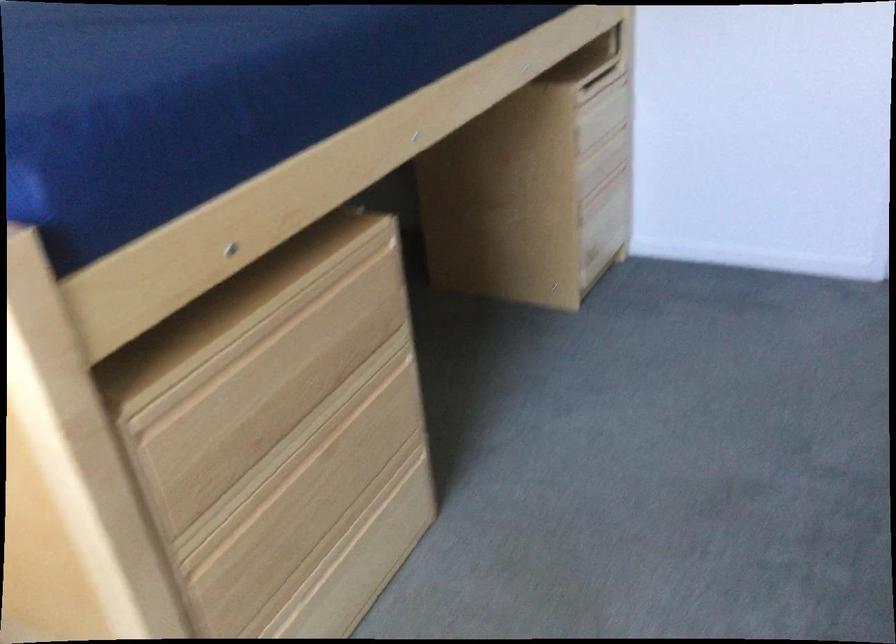
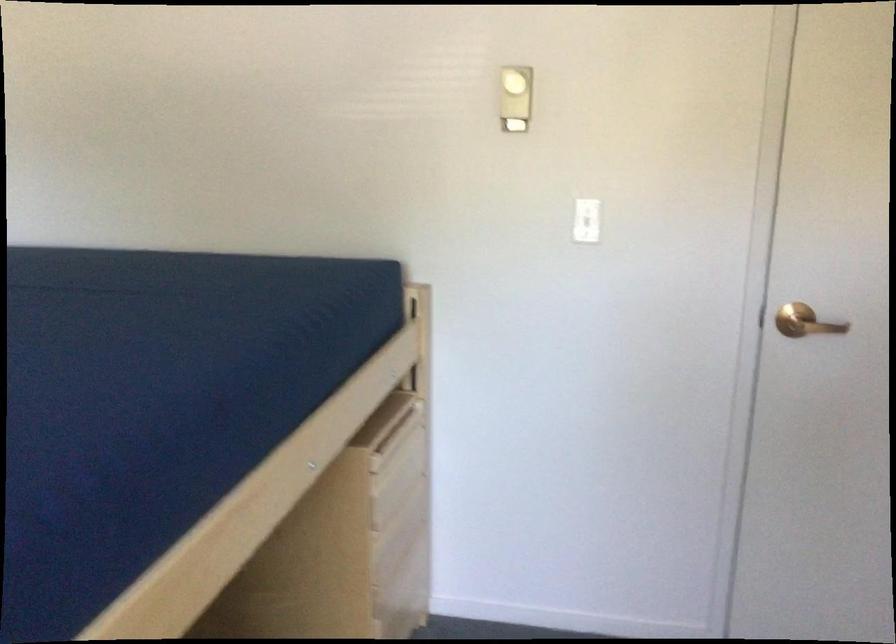
Find the pixel in the second image that matches (600,78) in the first image.

(399, 429)